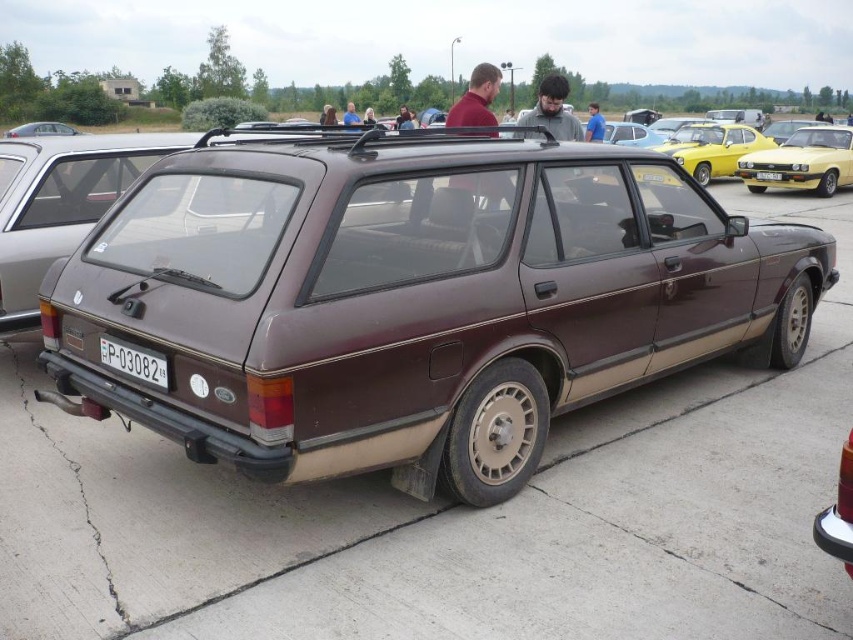
You are at a car show and want to locate the yellow metallic car at right. According to the scene, where is it positioned relative to the white plastic license plate at center?

The yellow metallic car at right is to the right of the white plastic license plate at center.